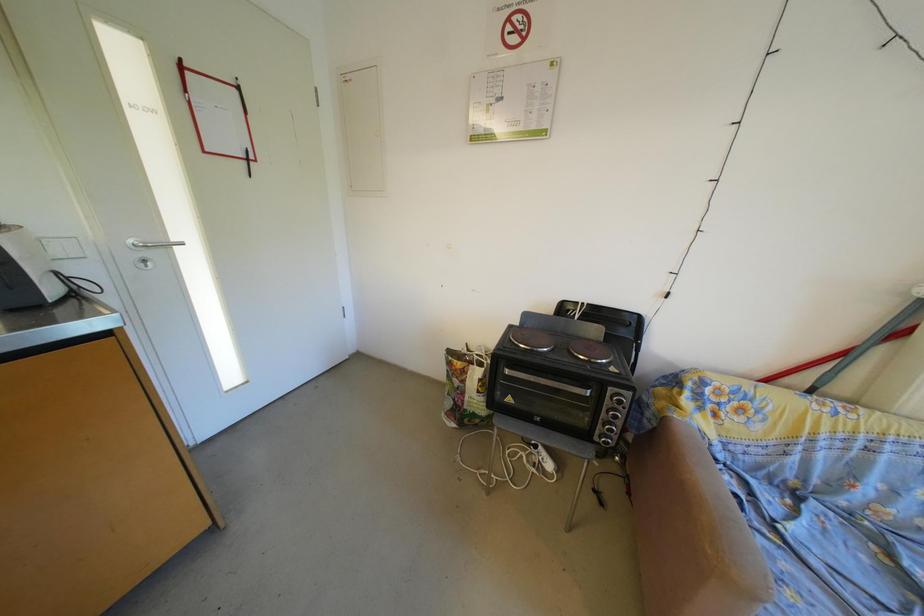
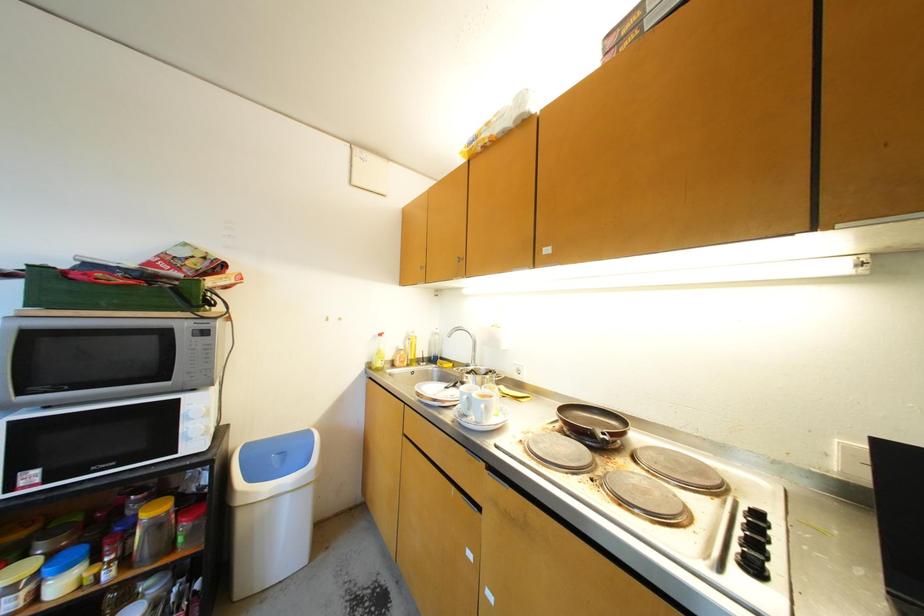
Question: The images are taken continuously from a first-person perspective. In which direction is your viewpoint rotating?

Choices:
 (A) Left
 (B) Right
 (C) Up
 (D) Down

Answer: (A)